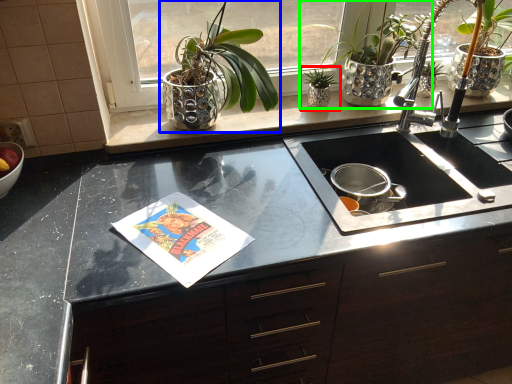
Question: Based on their relative distances, which object is farther from houseplant (highlighted by a red box)? Choose from houseplant (highlighted by a blue box) and houseplant (highlighted by a green box).

Choices:
 (A) houseplant
 (B) houseplant

Answer: (A)